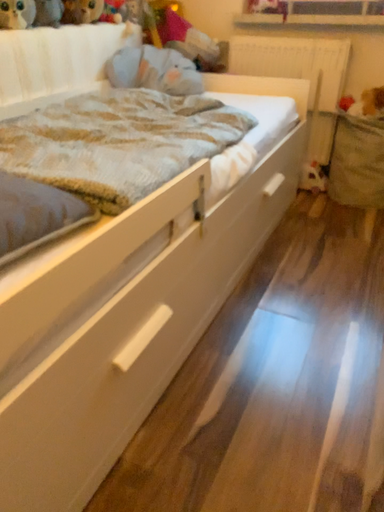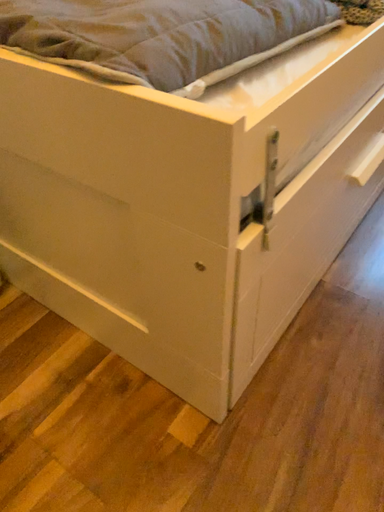
Question: How did the camera likely rotate when shooting the video?

Choices:
 (A) rotated upward
 (B) rotated downward

Answer: (B)